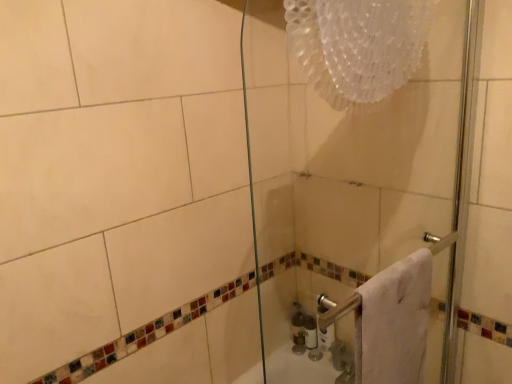
Question: Is transparent glass shower door at center surrounded by white glossy toilet paper at lower right?

Choices:
 (A) yes
 (B) no

Answer: (B)

Question: From the image's perspective, is white glossy toilet paper at lower right above transparent glass shower door at center?

Choices:
 (A) no
 (B) yes

Answer: (A)

Question: Is white glossy toilet paper at lower right outside of transparent glass shower door at center?

Choices:
 (A) yes
 (B) no

Answer: (A)

Question: Can you confirm if white glossy toilet paper at lower right is thinner than transparent glass shower door at center?

Choices:
 (A) yes
 (B) no

Answer: (A)

Question: Does white glossy toilet paper at lower right lie in front of transparent glass shower door at center?

Choices:
 (A) yes
 (B) no

Answer: (B)

Question: Is white glossy toilet paper at lower right taller than transparent glass shower door at center?

Choices:
 (A) yes
 (B) no

Answer: (B)

Question: From the image's perspective, is transparent glass shower door at center beneath white glossy bottle at lower center?

Choices:
 (A) no
 (B) yes

Answer: (A)

Question: Does transparent glass shower door at center have a greater width compared to white glossy bottle at lower center?

Choices:
 (A) no
 (B) yes

Answer: (B)

Question: Does transparent glass shower door at center appear on the left side of white glossy bottle at lower center?

Choices:
 (A) no
 (B) yes

Answer: (A)

Question: Would you consider transparent glass shower door at center to be distant from white glossy bottle at lower center?

Choices:
 (A) yes
 (B) no

Answer: (B)

Question: From a real-world perspective, is transparent glass shower door at center physically below white glossy bottle at lower center?

Choices:
 (A) no
 (B) yes

Answer: (A)

Question: Is transparent glass shower door at center located outside white glossy bottle at lower center?

Choices:
 (A) yes
 (B) no

Answer: (A)

Question: From a real-world perspective, is white glossy bottle at lower center under transparent glass shower door at center?

Choices:
 (A) yes
 (B) no

Answer: (A)